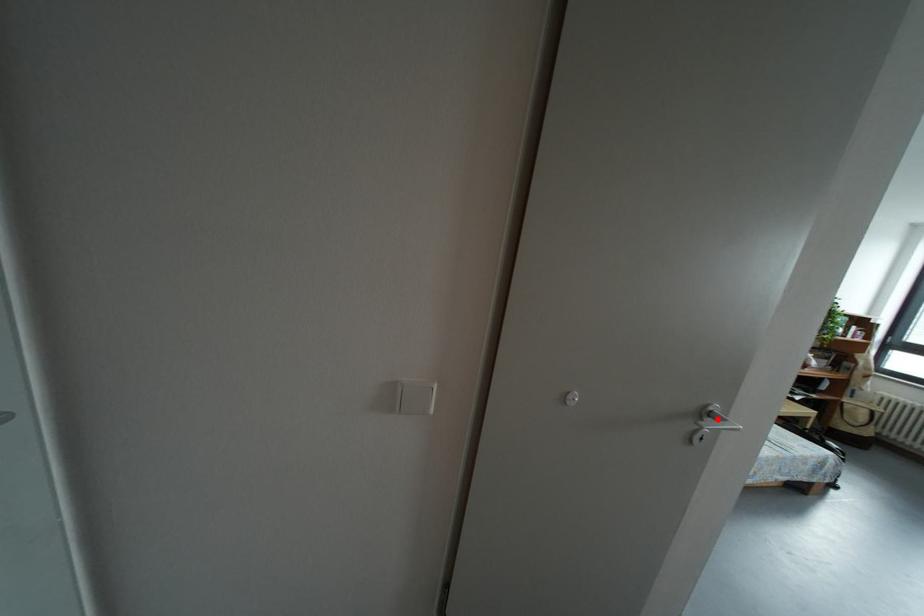
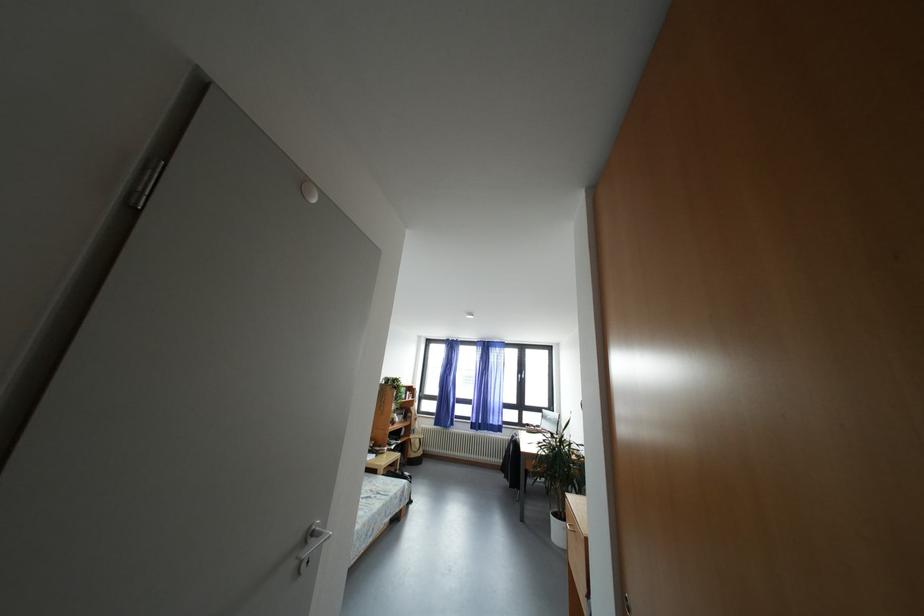
Where in the second image is the point corresponding to the highlighted location from the first image?

(320, 539)